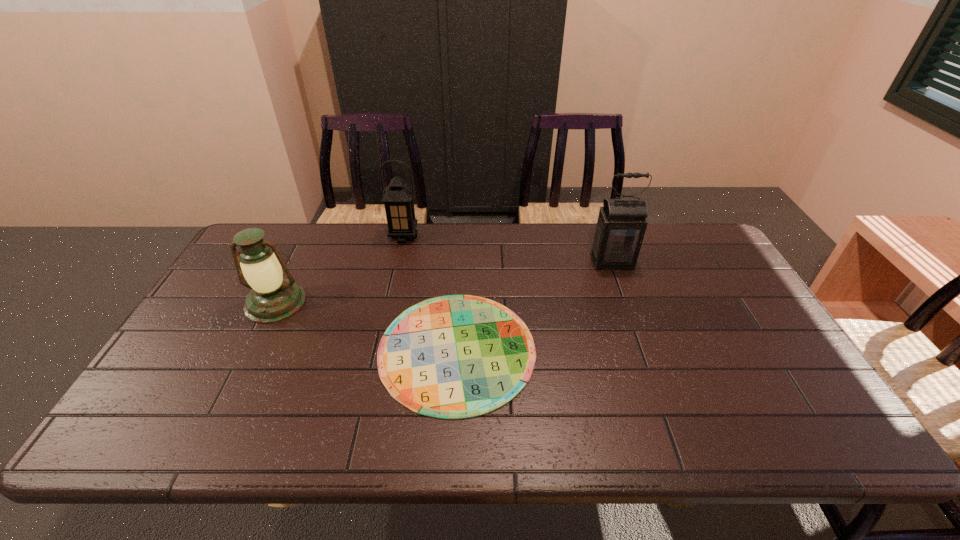
You are a GUI agent. You are given a task and a screenshot of the screen. Output one action in this format:
    pyautogui.click(x=<x>, y=<y>)
    Task: Click on the rightmost lantern
    The image size is (960, 540).
    Given the screenshot: What is the action you would take?
    pyautogui.click(x=620, y=229)

The image size is (960, 540). What are the coordinates of `the second farthest lantern` in the screenshot? It's located at (620, 229).

At what (x,y) coordinates should I click in order to perform the action: click on the farthest lantern. Please return your answer as a coordinate pair (x, y). Looking at the image, I should click on pos(398,197).

You are a GUI agent. You are given a task and a screenshot of the screen. Output one action in this format:
    pyautogui.click(x=<x>, y=<y>)
    Task: Click on the second lantern from left to right
    This screenshot has width=960, height=540.
    Given the screenshot: What is the action you would take?
    pyautogui.click(x=398, y=197)

Identify the location of the shortest lantern. (272, 299).

The height and width of the screenshot is (540, 960). I want to click on the leftmost object, so click(272, 299).

Where is `the shortest object`? The height and width of the screenshot is (540, 960). the shortest object is located at coordinates (457, 356).

Identify the location of vacant space located 0.280m on the front-facing side of the rightmost lantern. The image size is (960, 540). (640, 340).

Locate an element on the screen. This screenshot has height=540, width=960. free spot located 0.100m on the left of the second lantern from right to left is located at coordinates (360, 237).

I want to click on free region located with the light compartment facing forward on the leftmost lantern, so click(212, 430).